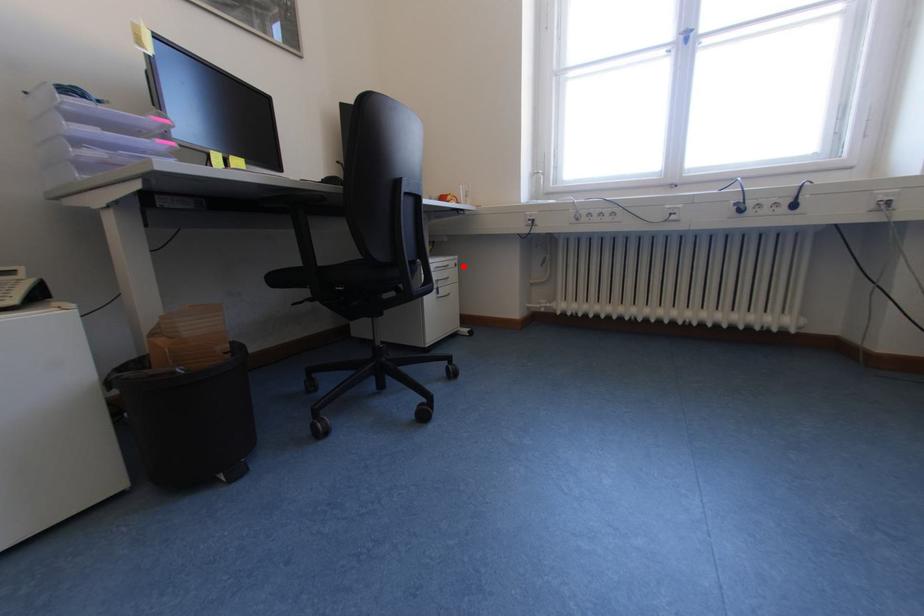
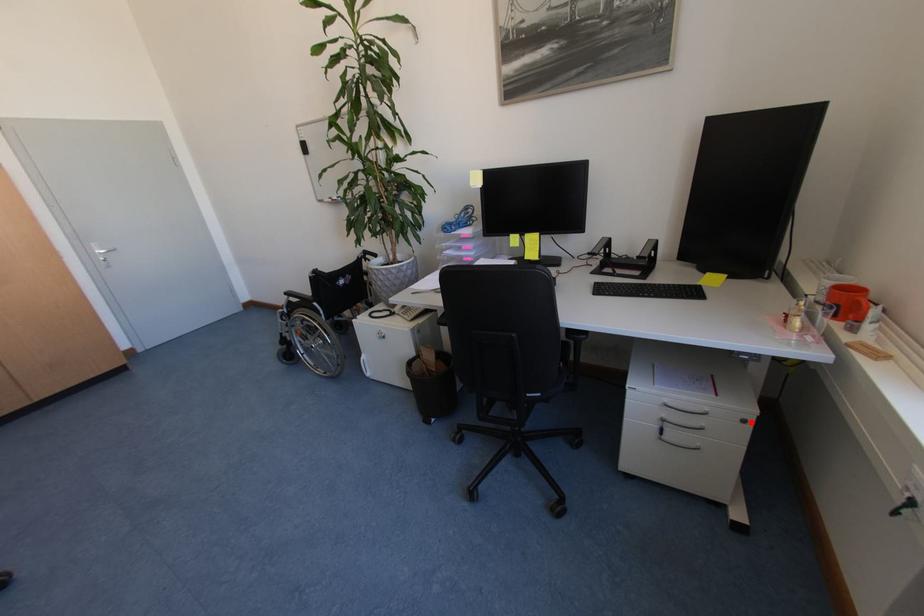
I am providing you with two images of the same scene from different viewpoints. A red point is marked on the first image and another point is marked on the second image. Does the point marked in image1 correspond to the same location as the one in image2?

Yes